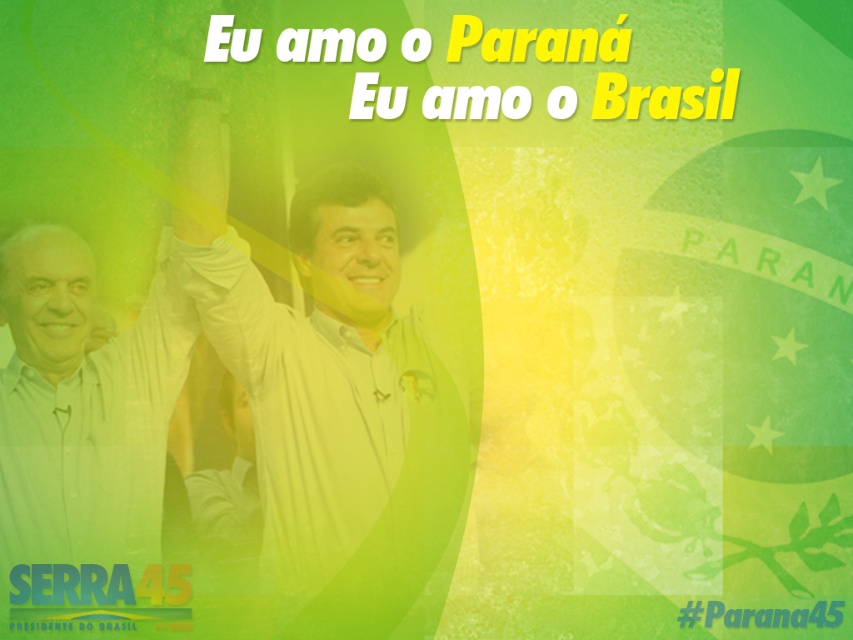
Can you confirm if white shirt at center is positioned above #parana45 at center?

Yes, white shirt at center is above #parana45 at center.

Where is `white shirt at center`? The height and width of the screenshot is (640, 853). white shirt at center is located at coordinates (332, 401).

Is white shirt at center closer to the viewer compared to whitematerial/texturetext at upper center?

Yes, white shirt at center is closer to the viewer.

Image resolution: width=853 pixels, height=640 pixels. What do you see at coordinates (332, 401) in the screenshot?
I see `white shirt at center` at bounding box center [332, 401].

The width and height of the screenshot is (853, 640). I want to click on white shirt at center, so click(332, 401).

Which is behind, point (596, 109) or point (738, 621)?

Positioned behind is point (596, 109).

Between whitematerial/texturetext at upper center and #parana45 at center, which one has less height?

#parana45 at center is shorter.

Between point (593, 104) and point (740, 625), which one is positioned in front?

Point (740, 625) is more forward.

Locate an element on the screen. The width and height of the screenshot is (853, 640). whitematerial/texturetext at upper center is located at coordinates (666, 97).